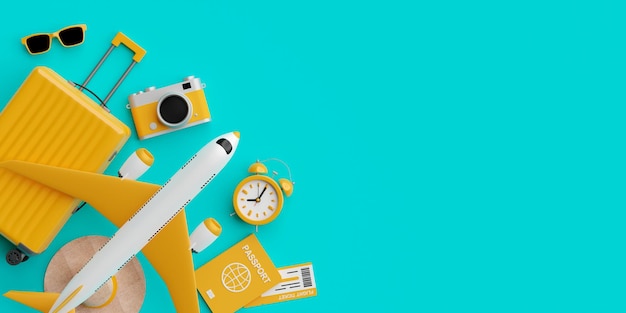
Identify the location of yellow and white alarm clock. Image resolution: width=626 pixels, height=313 pixels. (255, 180).